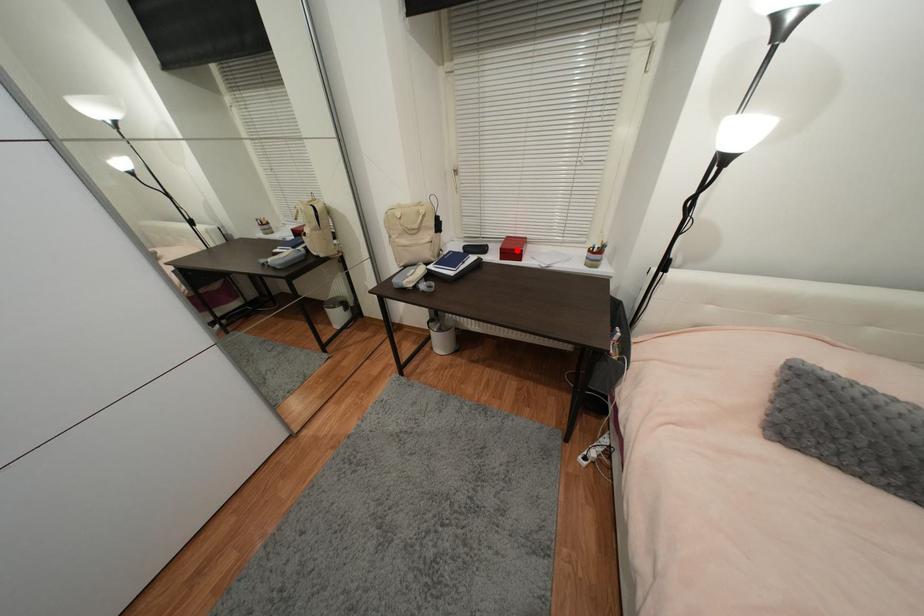
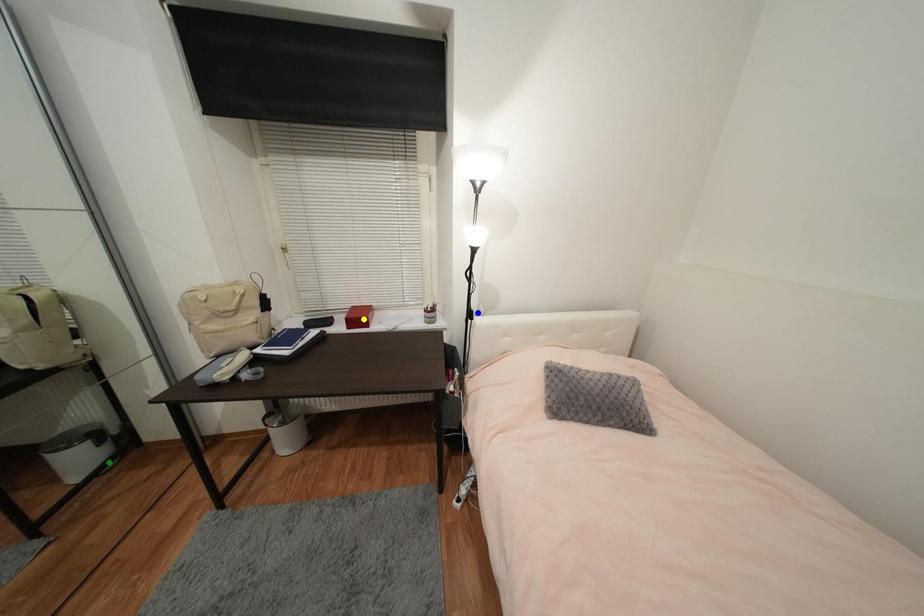
Question: I am providing you with two images of the same scene from different viewpoints. A red point is marked on the first image. You are given multiple points on the second image. Which spot in image 2 lines up with the point in image 1?

Choices:
 (A) blue point
 (B) green point
 (C) yellow point

Answer: (C)